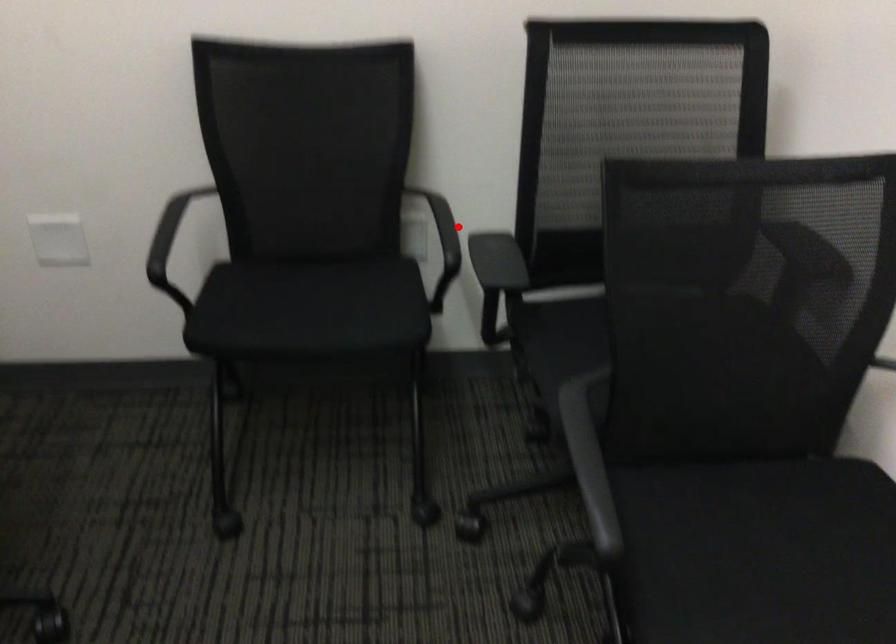
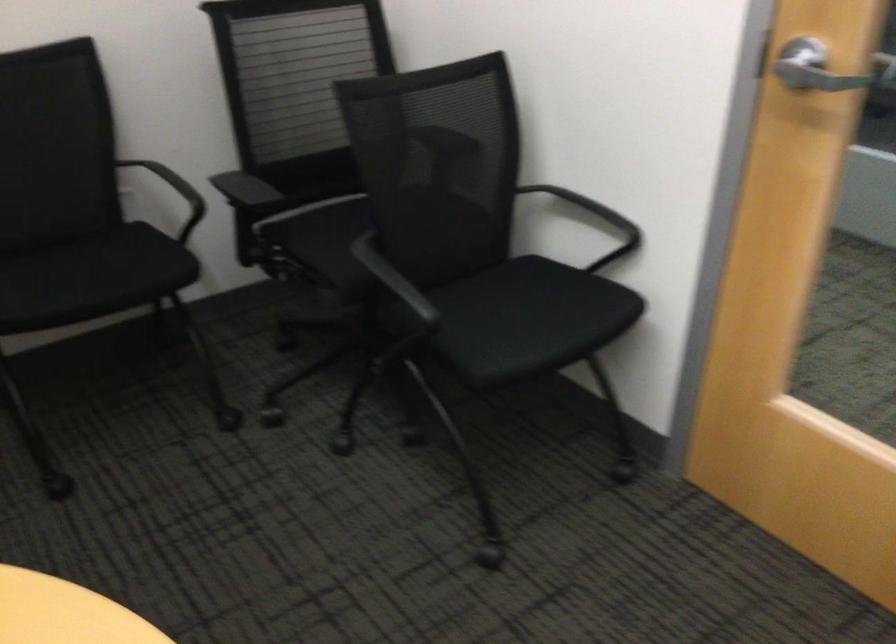
Question: I am providing you with two images of the same scene from different viewpoints. Given a red point in image1, look at the same physical point in image2. Is it:

Choices:
 (A) Closer to the viewpoint
 (B) Farther from the viewpoint

Answer: (B)